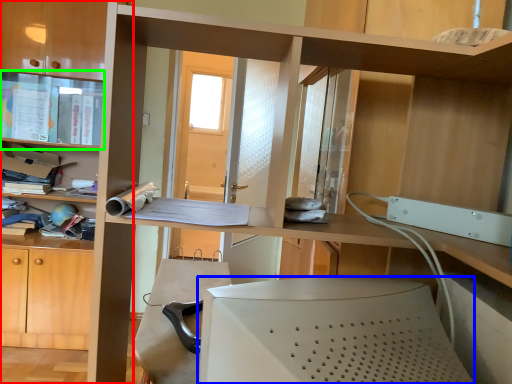
Question: Which object is positioned closest to bookcase (highlighted by a red box)? Select from desktop computer (highlighted by a blue box) and cabinet (highlighted by a green box).

Choices:
 (A) desktop computer
 (B) cabinet

Answer: (B)